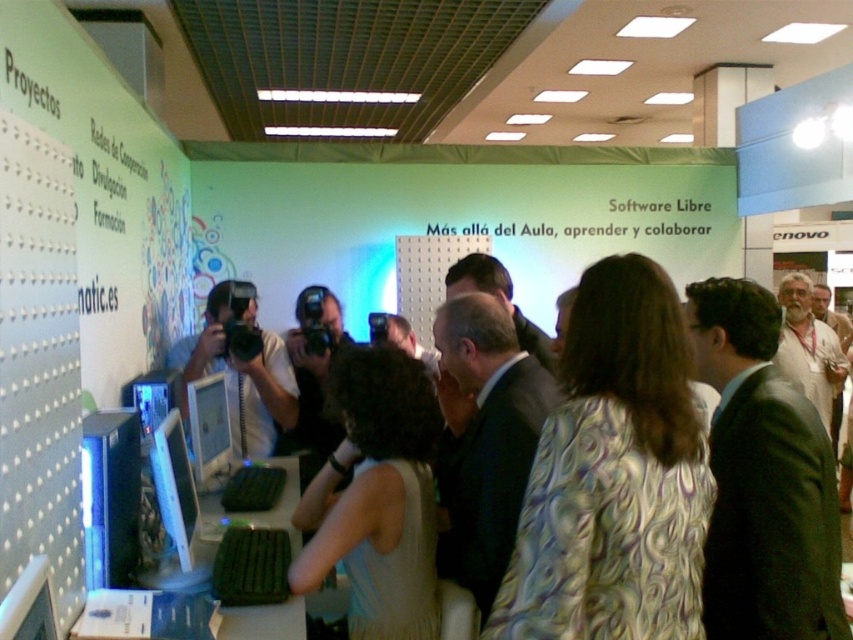
Question: Can you confirm if matte black monitor at center is positioned above matte white monitor at center?

Choices:
 (A) yes
 (B) no

Answer: (B)

Question: Among these points, which one is farthest from the camera?

Choices:
 (A) (183, 496)
 (B) (24, 580)
 (C) (206, 465)
 (D) (276, 422)

Answer: (D)

Question: Is matte white monitor at center closer to the viewer compared to matte black monitor at lower left?

Choices:
 (A) yes
 (B) no

Answer: (B)

Question: Considering the real-world distances, which object is farthest from the matte black camera at center?

Choices:
 (A) matte white monitor at center
 (B) matte black monitor at lower left
 (C) matte black monitor at center

Answer: (B)

Question: From the image, what is the correct spatial relationship of matte black camera at center in relation to matte black monitor at center?

Choices:
 (A) below
 (B) above

Answer: (B)

Question: Which object is farther from the camera taking this photo?

Choices:
 (A) matte black monitor at lower left
 (B) matte black monitor at center

Answer: (B)